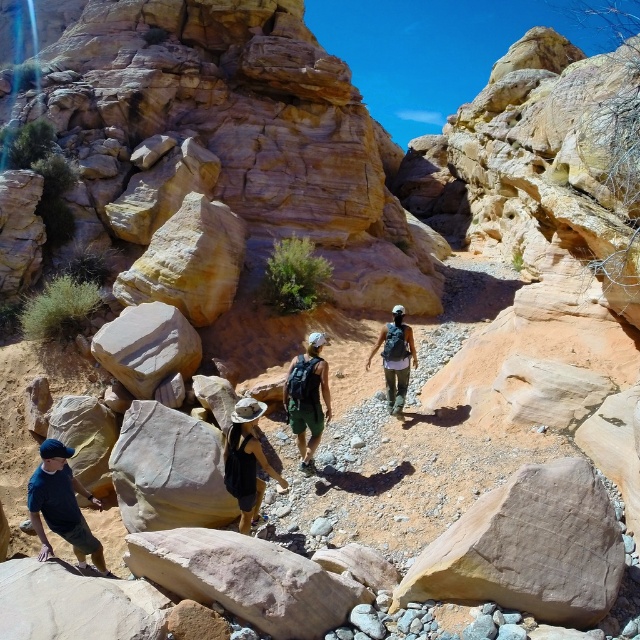
Question: Can you confirm if brown fabric hat at center is wider than matte black backpack at center?

Choices:
 (A) no
 (B) yes

Answer: (A)

Question: Which of the following is the closest to the observer?

Choices:
 (A) (232, 445)
 (B) (394, 406)
 (C) (108, 570)

Answer: (C)

Question: Does brown fabric hat at center appear under green fabric backpack at center?

Choices:
 (A) yes
 (B) no

Answer: (A)

Question: Which point is farther to the camera?

Choices:
 (A) (227, 435)
 (B) (312, 371)
 (C) (387, 364)

Answer: (C)

Question: Which point is farther from the camera taking this photo?

Choices:
 (A) (58, 470)
 (B) (385, 348)
 (C) (298, 422)

Answer: (B)

Question: Is brown fabric hat at center below green fabric backpack at center?

Choices:
 (A) no
 (B) yes

Answer: (B)